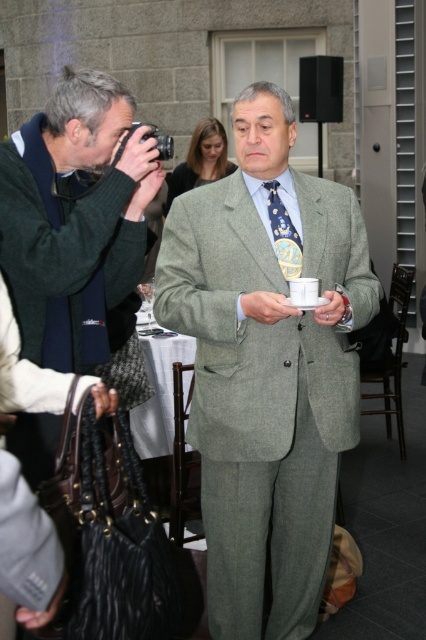
Question: Does green wool suit at center have a lesser width compared to matte black camera at left?

Choices:
 (A) no
 (B) yes

Answer: (A)

Question: Which of the following is the farthest from the observer?

Choices:
 (A) green wool suit at center
 (B) matte black camera at left

Answer: (A)

Question: Which object is farther from the camera taking this photo?

Choices:
 (A) green wool suit at center
 (B) blue dotted tie at center
 (C) matte black camera at left

Answer: (B)

Question: Is matte black camera at left smaller than blue dotted tie at center?

Choices:
 (A) yes
 (B) no

Answer: (B)

Question: Observing the image, what is the correct spatial positioning of matte black camera at left in reference to blue dotted tie at center?

Choices:
 (A) right
 (B) left

Answer: (B)

Question: Which point appears farthest from the camera in this image?

Choices:
 (A) (271, 216)
 (B) (69, 291)

Answer: (A)